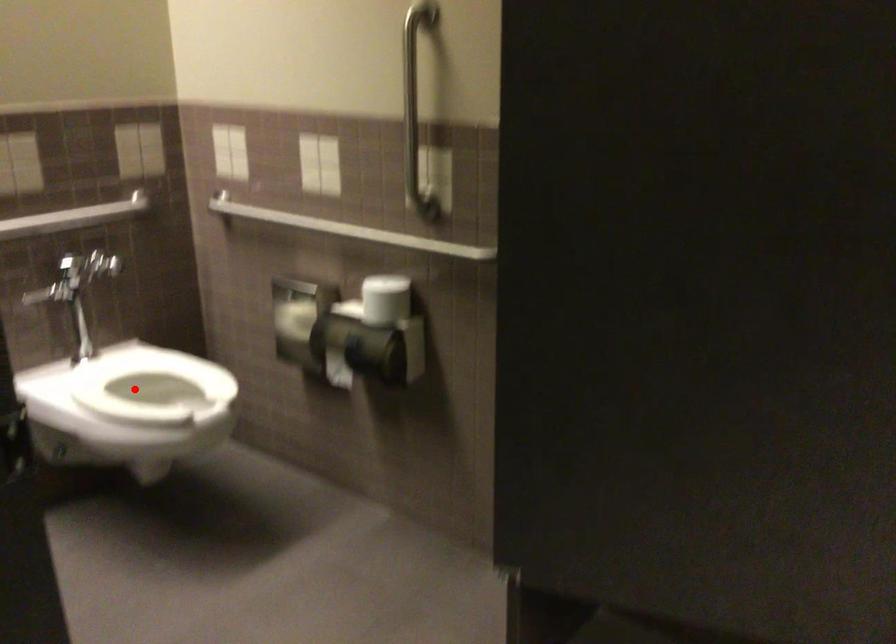
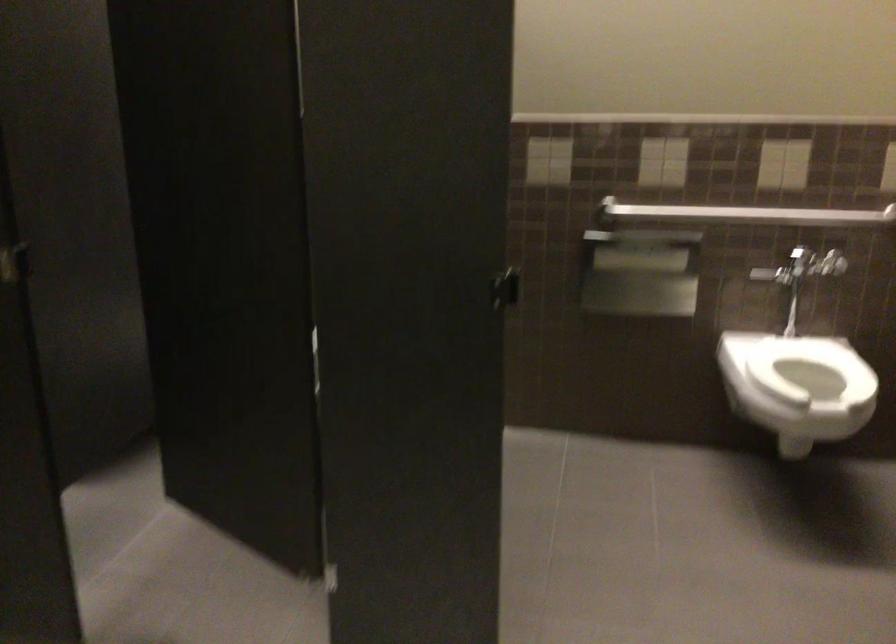
Find the pixel in the second image that matches the highlighted location in the first image.

(810, 368)